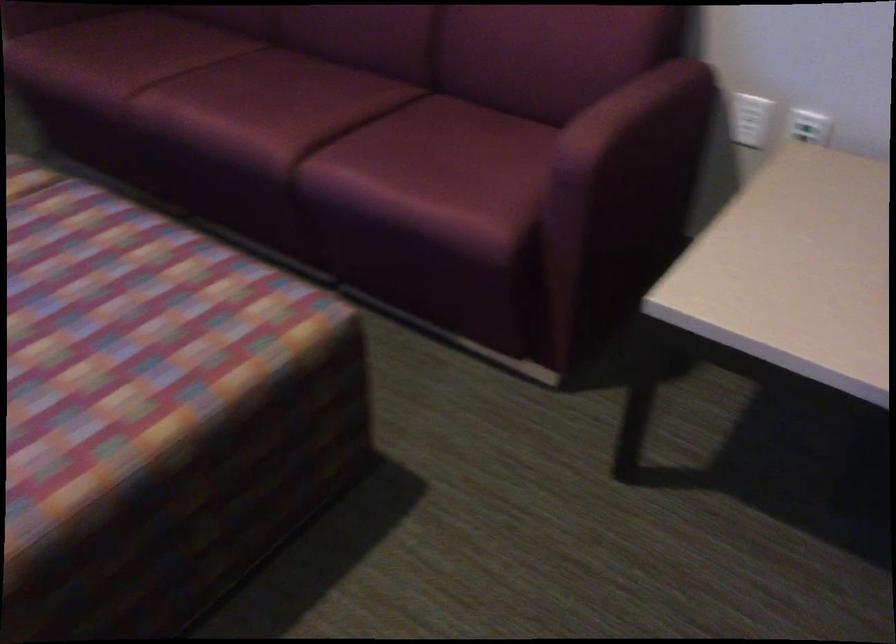
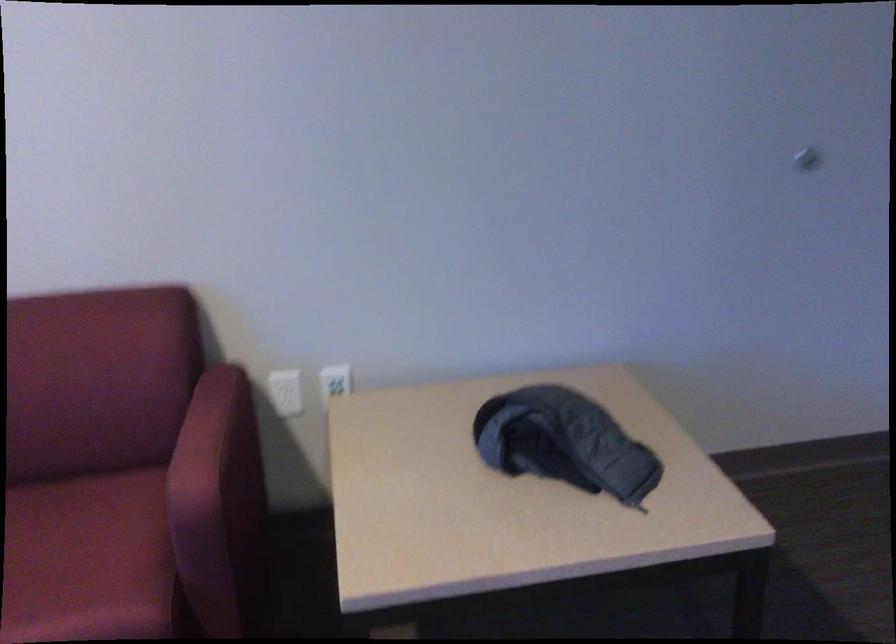
In the second image, find the point that corresponds to [797,131] in the first image.

(334, 382)